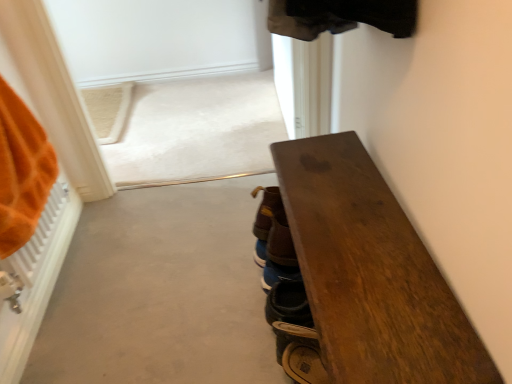
Identify the location of empty space that is ontop of dark wood bench at right. (358, 238).